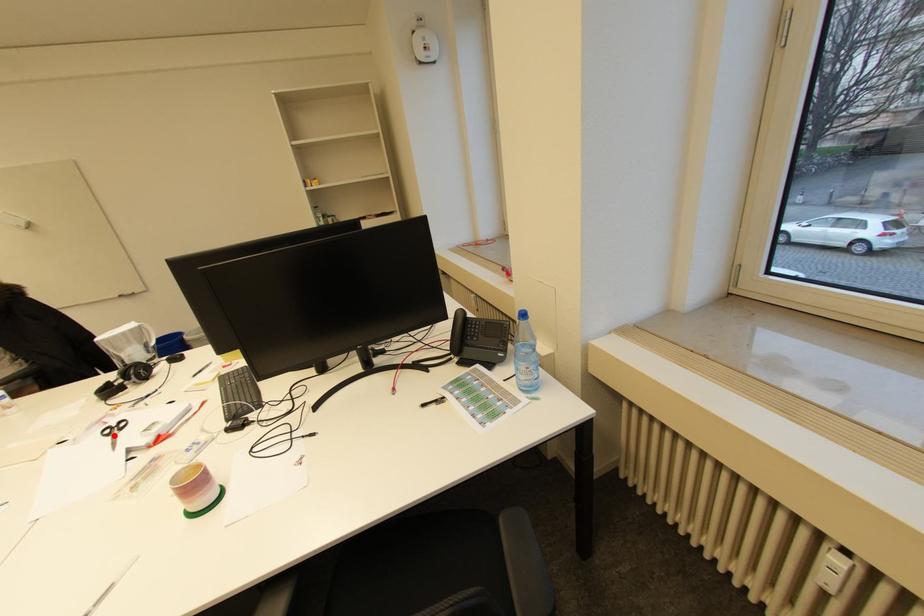
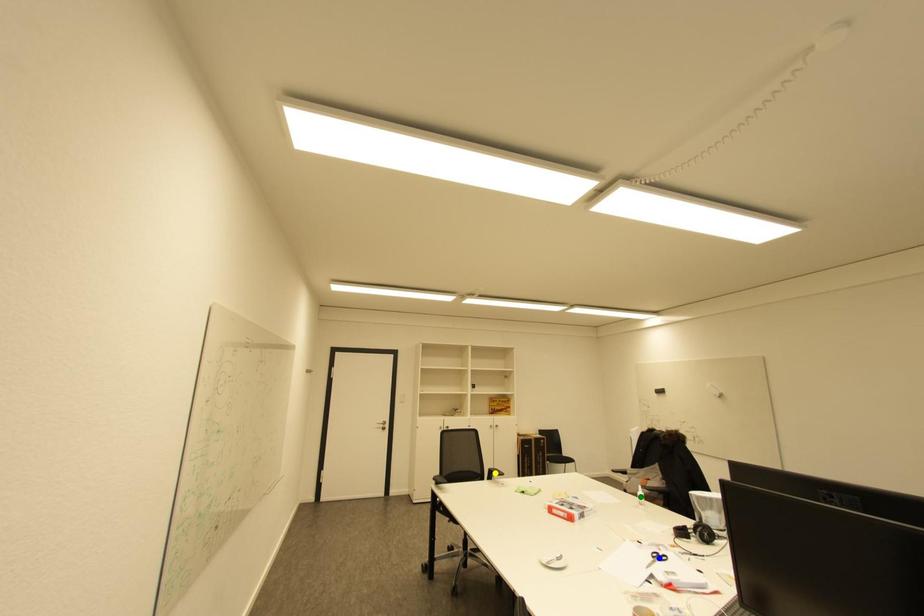
Question: I am providing you with two images of the same scene from different viewpoints. A red point is marked on the first image. You are given multiple points on the second image. In image 2, which mark is for the same physical point as the one in image 1?

Choices:
 (A) green point
 (B) blue point
 (C) yellow point

Answer: (B)